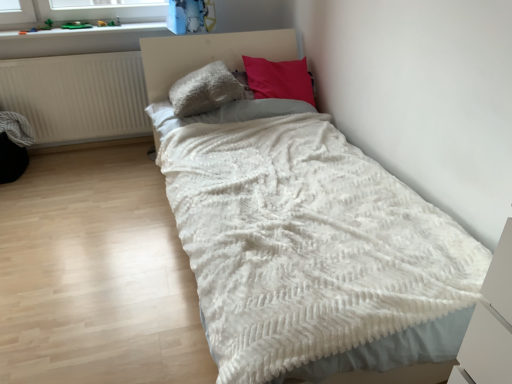
This screenshot has width=512, height=384. In order to click on free region on the left part of white fluffy blanket at center in this screenshot , I will do `click(93, 244)`.